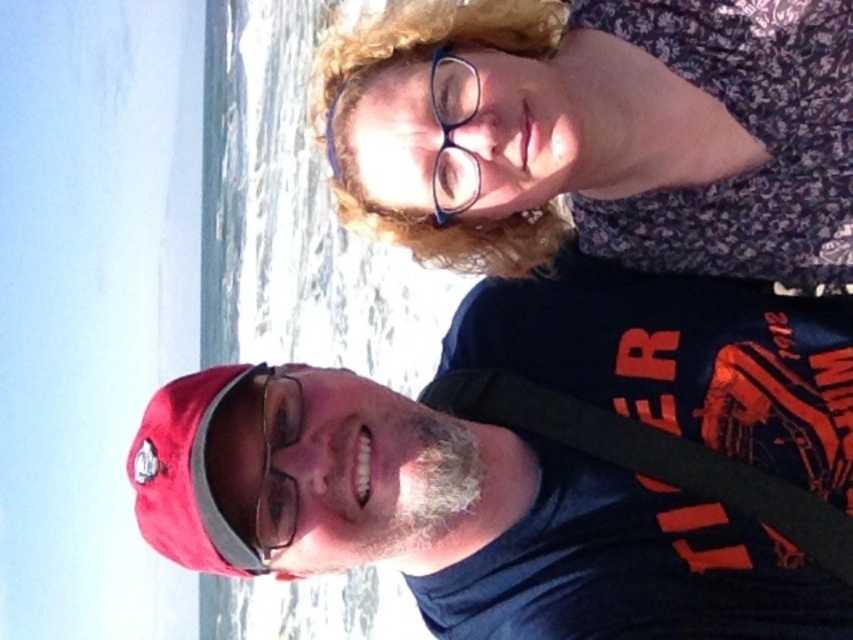
Does red cap at lower left appear under curly blonde hair at upper center?

Indeed, red cap at lower left is positioned under curly blonde hair at upper center.

Between point (428, 428) and point (375, 56), which one is positioned in front?

Positioned in front is point (428, 428).

Identify the location of red cap at lower left. (467, 518).

Which is more to the right, floral fabric dress at upper right or blue plastic glasses at upper center?

From the viewer's perspective, floral fabric dress at upper right appears more on the right side.

Who is more distant from viewer, [761,202] or [428,84]?

The point [761,202] is behind.

Does point (618, 173) come closer to viewer compared to point (467, 93)?

No, it is behind (467, 93).

The height and width of the screenshot is (640, 853). Identify the location of floral fabric dress at upper right. (599, 132).

The height and width of the screenshot is (640, 853). Describe the element at coordinates (467, 518) in the screenshot. I see `red cap at lower left` at that location.

Can you confirm if red cap at lower left is wider than clear plastic glasses at center?

Indeed, red cap at lower left has a greater width compared to clear plastic glasses at center.

Locate an element on the screen. The image size is (853, 640). red cap at lower left is located at coordinates (467, 518).